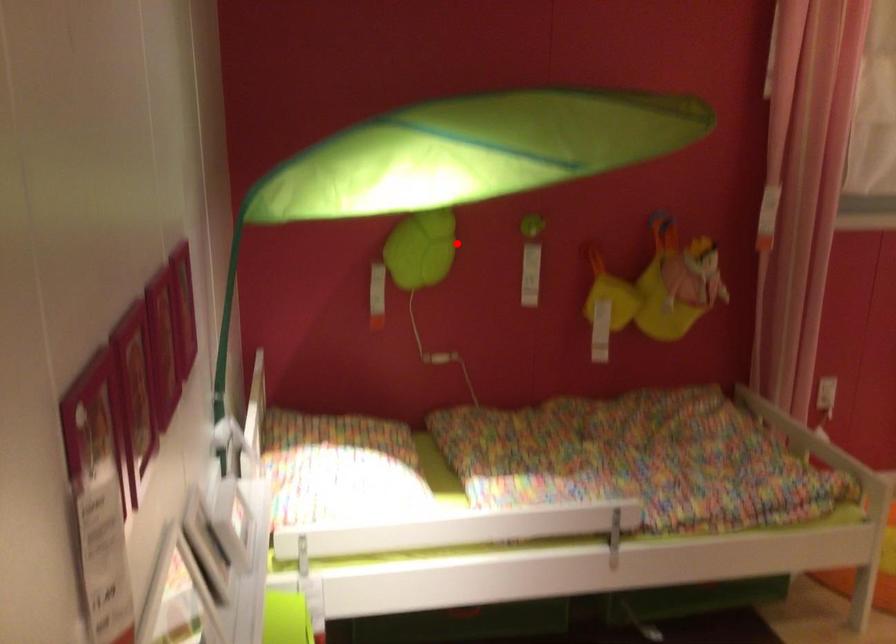
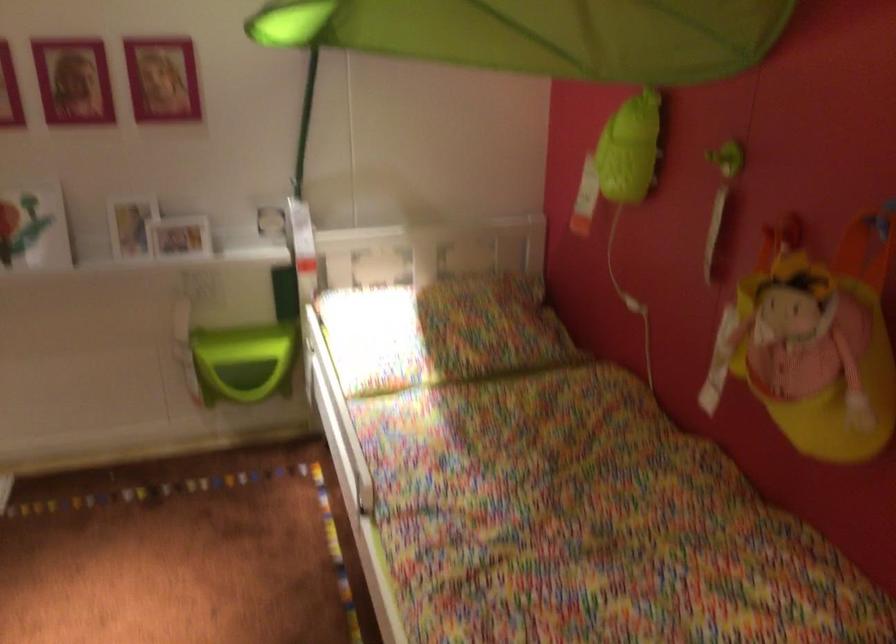
Locate, in the second image, the point that corresponds to the highlighted location in the first image.

(629, 149)